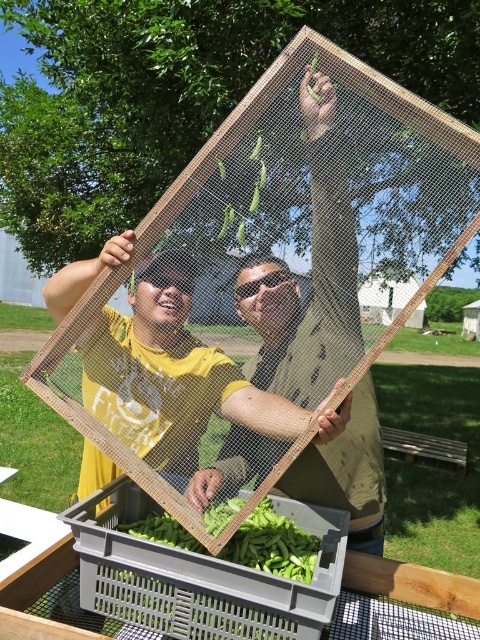
Question: Which point is farther from the camera taking this photo?

Choices:
 (A) (251, 273)
 (B) (266, 545)

Answer: (A)

Question: Which object is positioned farthest from the matte yellow shirt at center?

Choices:
 (A) wooden frame at center
 (B) green matte beans at center

Answer: (B)

Question: Can you confirm if wooden frame at center is positioned above matte yellow shirt at center?

Choices:
 (A) yes
 (B) no

Answer: (B)

Question: Which object is farther from the camera taking this photo?

Choices:
 (A) green matte beans at center
 (B) wooden frame at center
 (C) matte yellow shirt at center

Answer: (B)

Question: Is wooden frame at center to the left of matte yellow shirt at center from the viewer's perspective?

Choices:
 (A) yes
 (B) no

Answer: (B)

Question: Can you confirm if wooden frame at center is positioned to the right of matte yellow shirt at center?

Choices:
 (A) yes
 (B) no

Answer: (A)